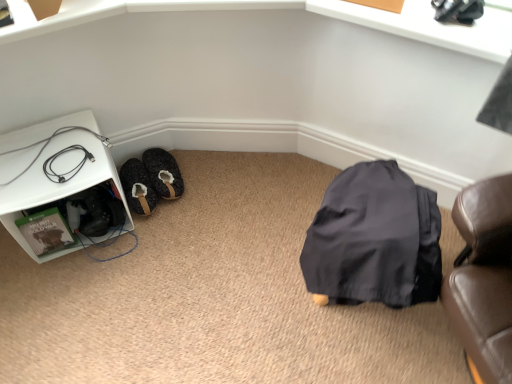
Question: Is fuzzy fabric slipper at lower left positioned with its back to fuzzy fabric slippers at lower left?

Choices:
 (A) no
 (B) yes

Answer: (A)

Question: Is fuzzy fabric slipper at lower left closer to camera compared to fuzzy fabric slippers at lower left?

Choices:
 (A) no
 (B) yes

Answer: (B)

Question: Does fuzzy fabric slipper at lower left turn towards fuzzy fabric slippers at lower left?

Choices:
 (A) no
 (B) yes

Answer: (A)

Question: Are fuzzy fabric slipper at lower left and fuzzy fabric slippers at lower left far apart?

Choices:
 (A) no
 (B) yes

Answer: (A)

Question: Does fuzzy fabric slipper at lower left lie behind fuzzy fabric slippers at lower left?

Choices:
 (A) no
 (B) yes

Answer: (A)

Question: Visually, is black rubber cable at lower left positioned to the left or to the right of white plastic shelf at left?

Choices:
 (A) right
 (B) left

Answer: (A)

Question: Is point (62, 177) closer or farther from the camera than point (6, 196)?

Choices:
 (A) farther
 (B) closer

Answer: (A)

Question: Considering the positions of black rubber cable at lower left and white plastic shelf at left in the image, is black rubber cable at lower left wider or thinner than white plastic shelf at left?

Choices:
 (A) thin
 (B) wide

Answer: (A)

Question: From a real-world perspective, is black rubber cable at lower left positioned above or below white plastic shelf at left?

Choices:
 (A) above
 (B) below

Answer: (A)

Question: In terms of height, does white plastic shelf at left look taller or shorter compared to fuzzy fabric slipper at lower left?

Choices:
 (A) tall
 (B) short

Answer: (A)

Question: From a real-world perspective, is white plastic shelf at left physically located above or below fuzzy fabric slipper at lower left?

Choices:
 (A) below
 (B) above

Answer: (B)

Question: In the image, is white plastic shelf at left positioned in front of or behind fuzzy fabric slipper at lower left?

Choices:
 (A) behind
 (B) front

Answer: (B)

Question: From the image's perspective, is white plastic shelf at left located above or below fuzzy fabric slipper at lower left?

Choices:
 (A) above
 (B) below

Answer: (A)

Question: Is fuzzy fabric slippers at lower left taller or shorter than white plastic shelf at left?

Choices:
 (A) tall
 (B) short

Answer: (B)

Question: Which is correct: fuzzy fabric slippers at lower left is inside white plastic shelf at left, or outside of it?

Choices:
 (A) outside
 (B) inside

Answer: (A)